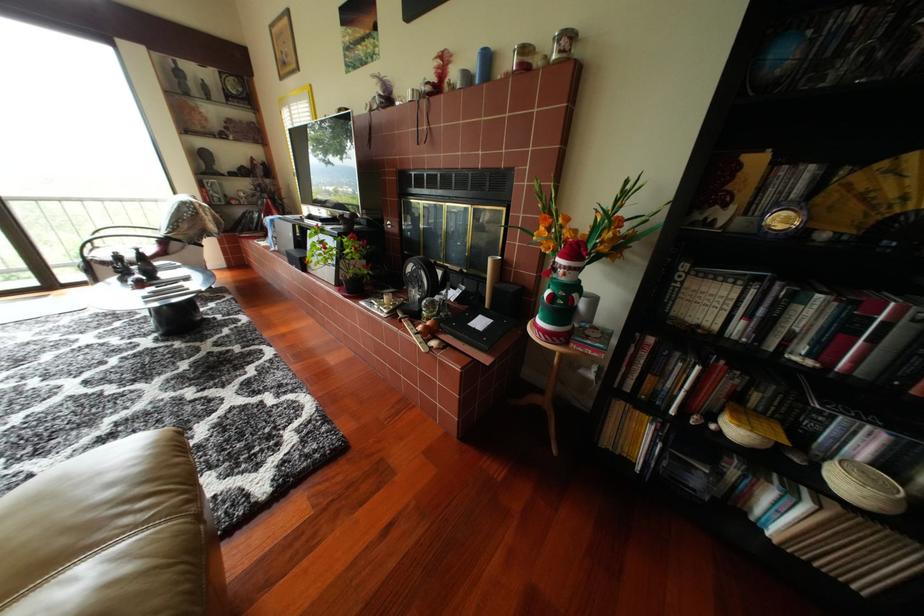
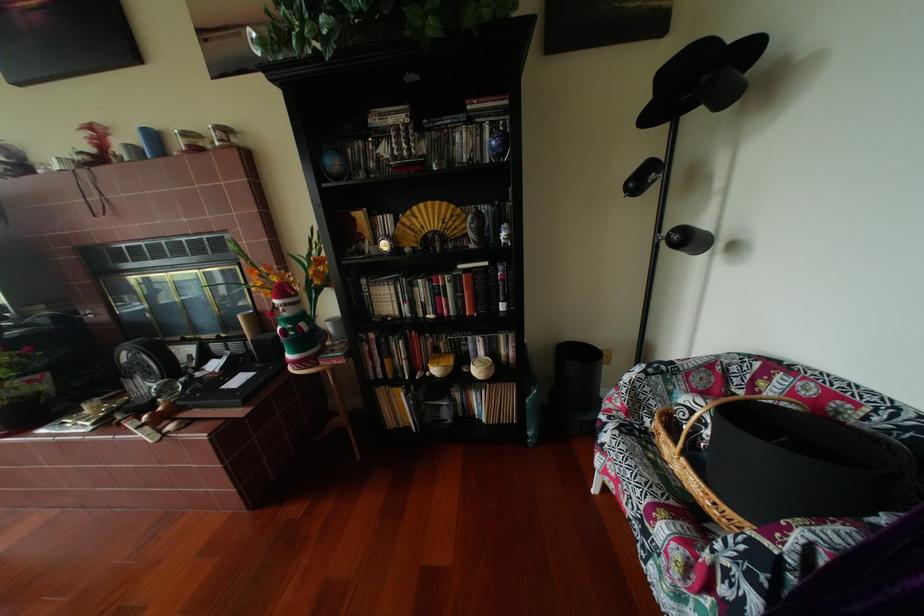
Locate, in the second image, the point that corresponds to point 375,304 in the first image.

(55, 432)